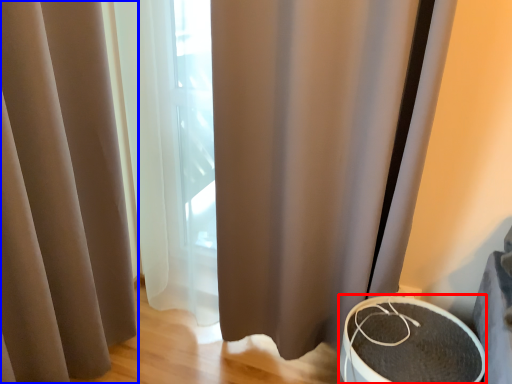
Question: Which point is further to the camera, round table (highlighted by a red box) or curtain (highlighted by a blue box)?

Choices:
 (A) round table
 (B) curtain

Answer: (A)